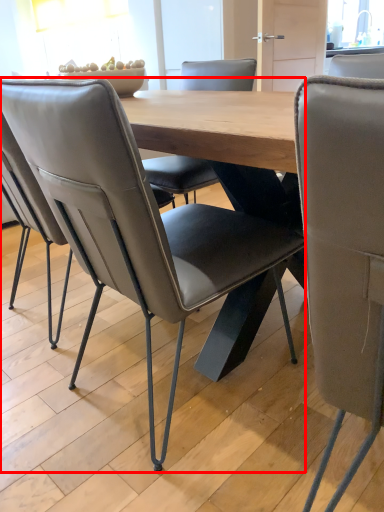
Question: Where is chair (annotated by the red box) located in relation to chair in the image?

Choices:
 (A) left
 (B) right

Answer: (A)